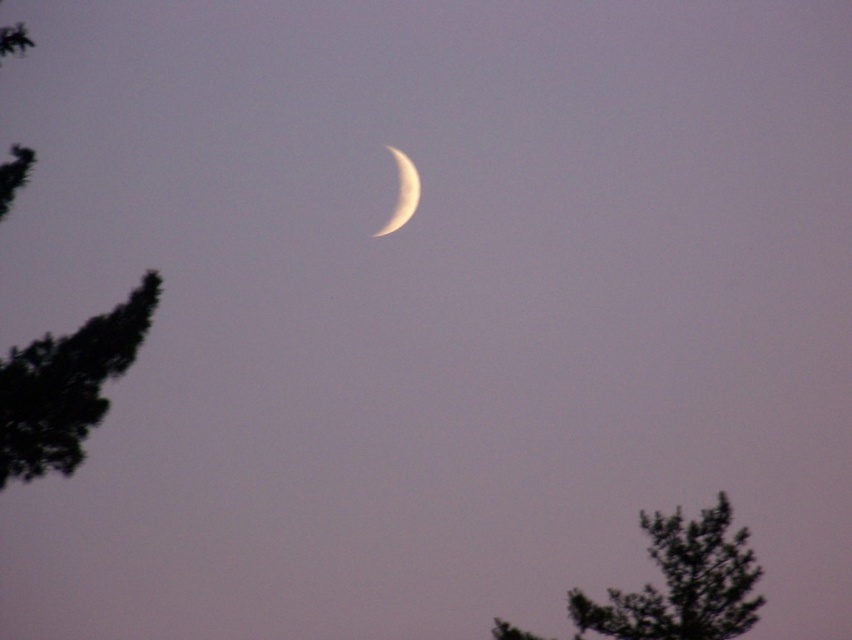
Consider the image. Which is more to the left, green leafy tree at left or green textured tree at lower right?

green leafy tree at left is more to the left.

Image resolution: width=852 pixels, height=640 pixels. Find the location of `green leafy tree at left`. green leafy tree at left is located at coordinates (66, 387).

Can you confirm if green textured tree at lower right is thinner than white glossy moon at center?

Yes.

Which is in front, point (692, 536) or point (401, 205)?

Point (692, 536) is more forward.

You are a GUI agent. You are given a task and a screenshot of the screen. Output one action in this format:
    pyautogui.click(x=<x>, y=<y>)
    Task: Click on the green textured tree at lower right
    This screenshot has height=640, width=852.
    Given the screenshot: What is the action you would take?
    pyautogui.click(x=681, y=582)

Can you confirm if green leafy tree at left is bigger than white glossy moon at center?

Incorrect, green leafy tree at left is not larger than white glossy moon at center.

Is green leafy tree at left thinner than white glossy moon at center?

Yes.

Does point (56, 424) come closer to viewer compared to point (395, 220)?

Yes, point (56, 424) is in front of point (395, 220).

Locate an element on the screen. green leafy tree at left is located at coordinates (66, 387).